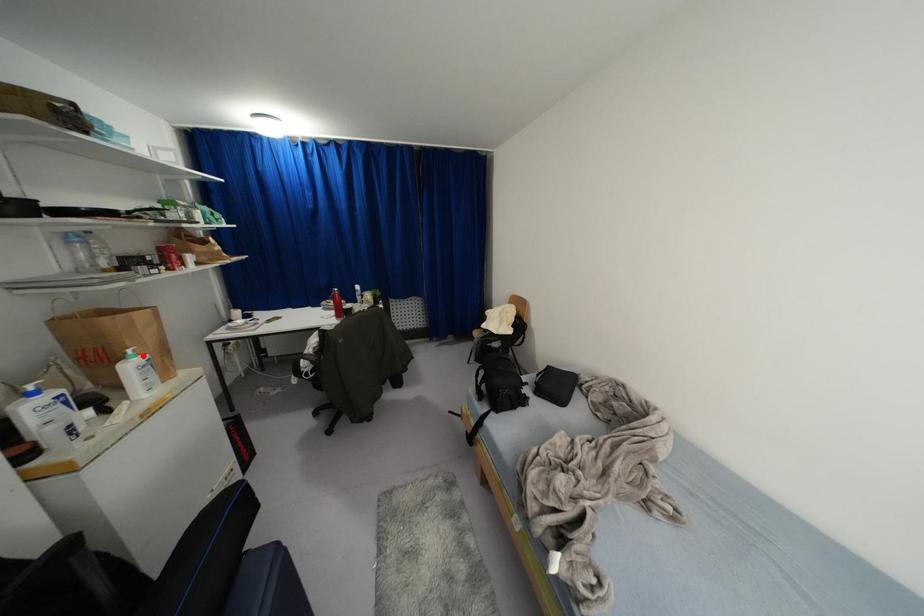
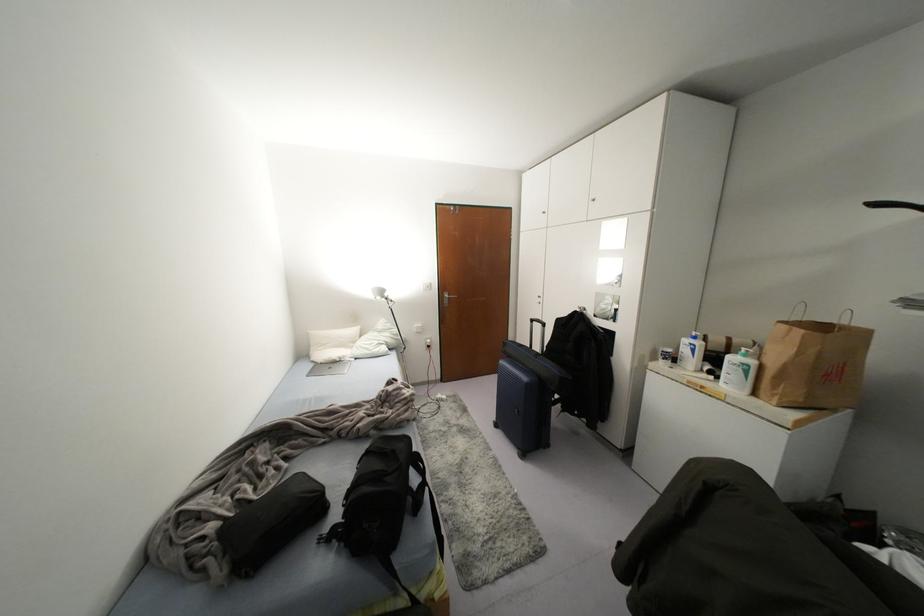
Find the pixel in the second image that matches the highlighted location in the first image.

(751, 362)